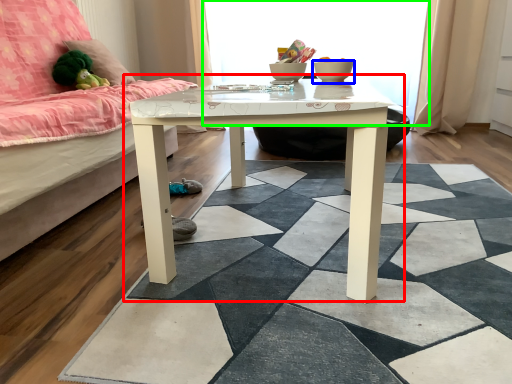
Question: Which is nearer to the table (highlighted by a red box)? glass bowl (highlighted by a blue box) or window screen (highlighted by a green box).

Choices:
 (A) glass bowl
 (B) window screen

Answer: (A)